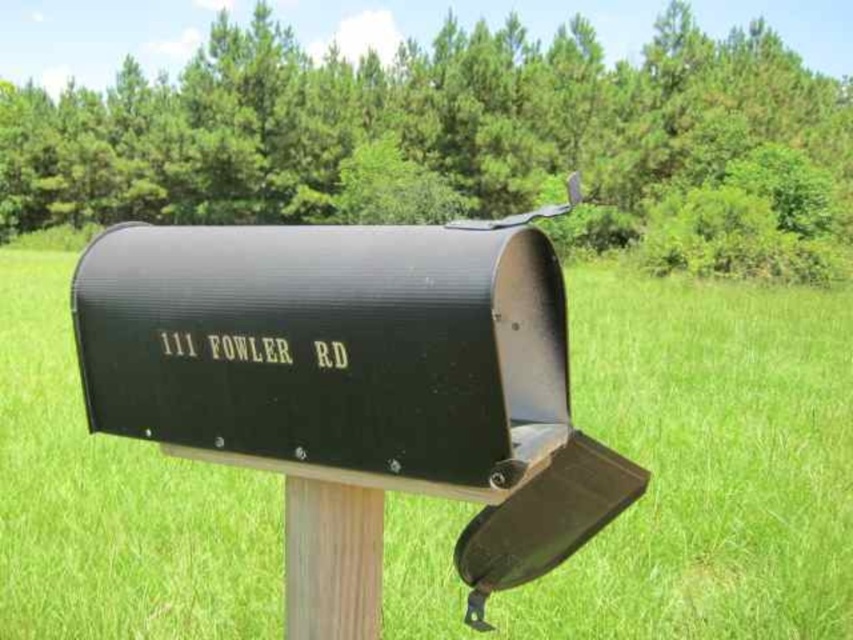
Question: Does black matte mailbox at center come behind wooden post at center?

Choices:
 (A) no
 (B) yes

Answer: (A)

Question: Does black matte mailbox at center appear under wooden post at center?

Choices:
 (A) no
 (B) yes

Answer: (A)

Question: Does black matte mailbox at center have a greater width compared to wooden post at center?

Choices:
 (A) no
 (B) yes

Answer: (B)

Question: Which of the following is the farthest from the observer?

Choices:
 (A) wooden post at center
 (B) black matte mailbox at center

Answer: (A)

Question: Which object appears closest to the camera in this image?

Choices:
 (A) wooden post at center
 (B) black matte mailbox at center

Answer: (B)